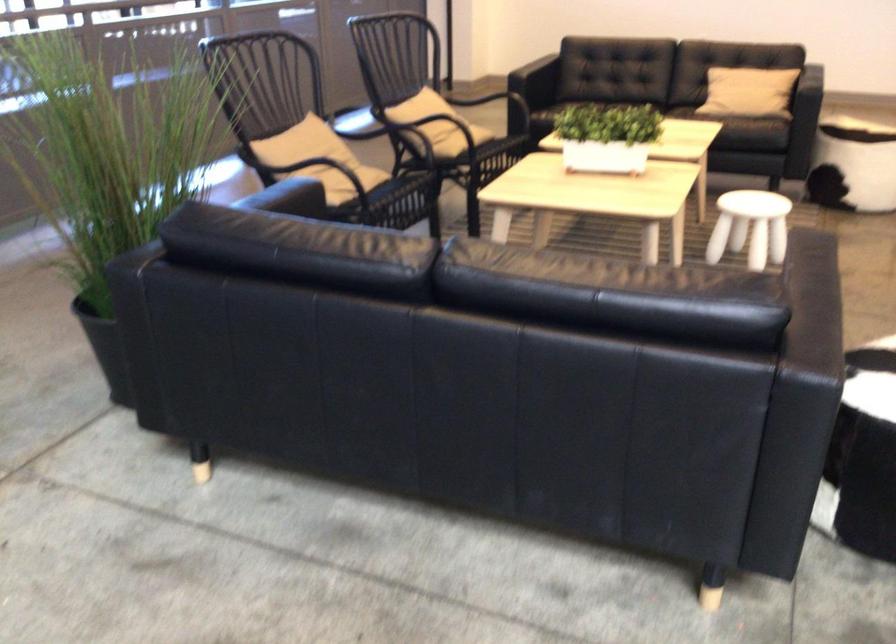
Find where to lift the small white stool. Please return your answer as a coordinate pair (x, y).

(750, 227)